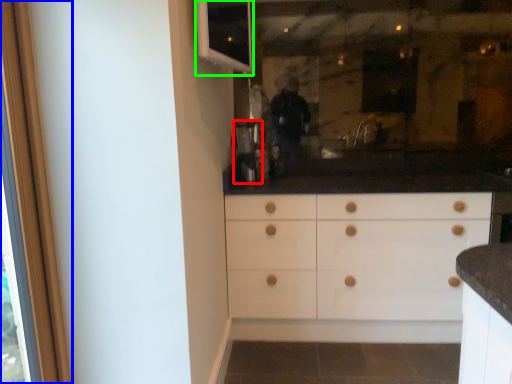
Question: Which object is positioned farthest from coffee machine (highlighted by a red box)? Select from screen door (highlighted by a blue box) and window (highlighted by a green box).

Choices:
 (A) screen door
 (B) window

Answer: (A)